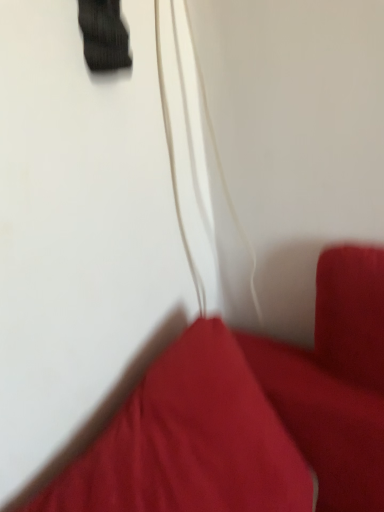
Question: Should I look upward or downward to see matte red pillow at lower right?

Choices:
 (A) up
 (B) down

Answer: (B)

Question: Is white matte string at center not near matte red pillow at lower right?

Choices:
 (A) no
 (B) yes

Answer: (A)

Question: Is white matte string at center further to camera compared to matte red pillow at lower right?

Choices:
 (A) no
 (B) yes

Answer: (B)

Question: From the image's perspective, does white matte string at center appear lower than matte red pillow at lower right?

Choices:
 (A) no
 (B) yes

Answer: (A)

Question: From a real-world perspective, is white matte string at center located beneath matte red pillow at lower right?

Choices:
 (A) yes
 (B) no

Answer: (B)

Question: From a real-world perspective, is white matte string at center located higher than matte red pillow at lower right?

Choices:
 (A) yes
 (B) no

Answer: (A)

Question: Considering the relative sizes of white matte string at center and matte red pillow at lower right in the image provided, is white matte string at center wider than matte red pillow at lower right?

Choices:
 (A) no
 (B) yes

Answer: (A)

Question: Is matte red pillow at lower right outside of white matte string at center?

Choices:
 (A) yes
 (B) no

Answer: (A)

Question: From the image's perspective, is matte red pillow at lower right below white matte string at center?

Choices:
 (A) yes
 (B) no

Answer: (A)

Question: Does matte red pillow at lower right have a larger size compared to white matte string at center?

Choices:
 (A) no
 (B) yes

Answer: (B)

Question: Is matte red pillow at lower right facing away from white matte string at center?

Choices:
 (A) no
 (B) yes

Answer: (A)

Question: Is matte red pillow at lower right wider than white matte string at center?

Choices:
 (A) yes
 (B) no

Answer: (A)

Question: Is matte red pillow at lower right positioned behind white matte string at center?

Choices:
 (A) yes
 (B) no

Answer: (B)

Question: From the image's perspective, is matte red pillow at lower right above or below white matte string at center?

Choices:
 (A) below
 (B) above

Answer: (A)